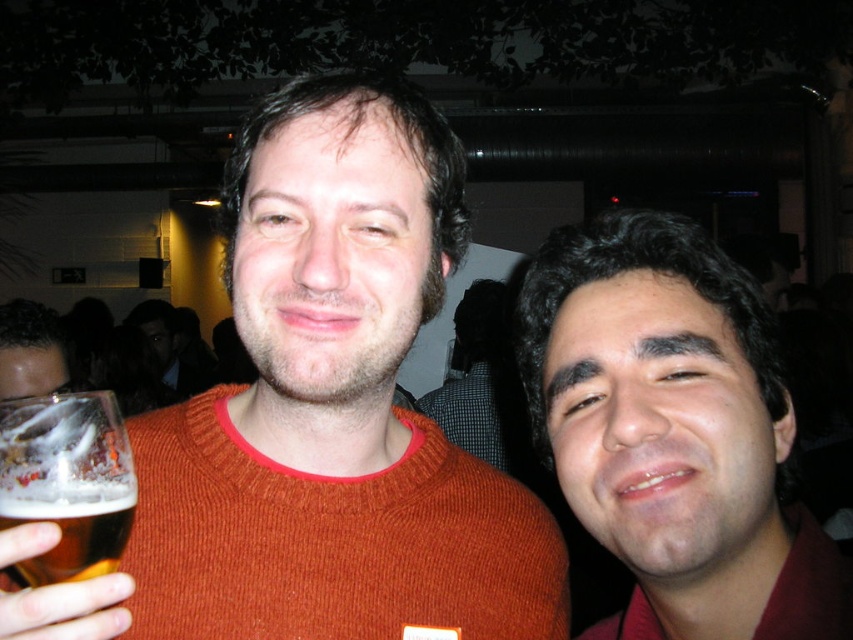
Question: Which of these objects is positioned farthest from the orange knitted sweater at center?

Choices:
 (A) matte red shirt at right
 (B) translucent glass at left

Answer: (B)

Question: Can you confirm if matte red shirt at right is positioned above translucent glass at left?

Choices:
 (A) yes
 (B) no

Answer: (A)

Question: Which object appears closest to the camera in this image?

Choices:
 (A) orange knitted sweater at center
 (B) matte red shirt at right
 (C) translucent glass at left

Answer: (A)

Question: Is matte red shirt at right below translucent glass at left?

Choices:
 (A) no
 (B) yes

Answer: (A)

Question: Is orange knitted sweater at center to the left of matte red shirt at right from the viewer's perspective?

Choices:
 (A) yes
 (B) no

Answer: (A)

Question: Which point is farther to the camera?

Choices:
 (A) orange knitted sweater at center
 (B) translucent glass at left
 (C) matte red shirt at right

Answer: (C)